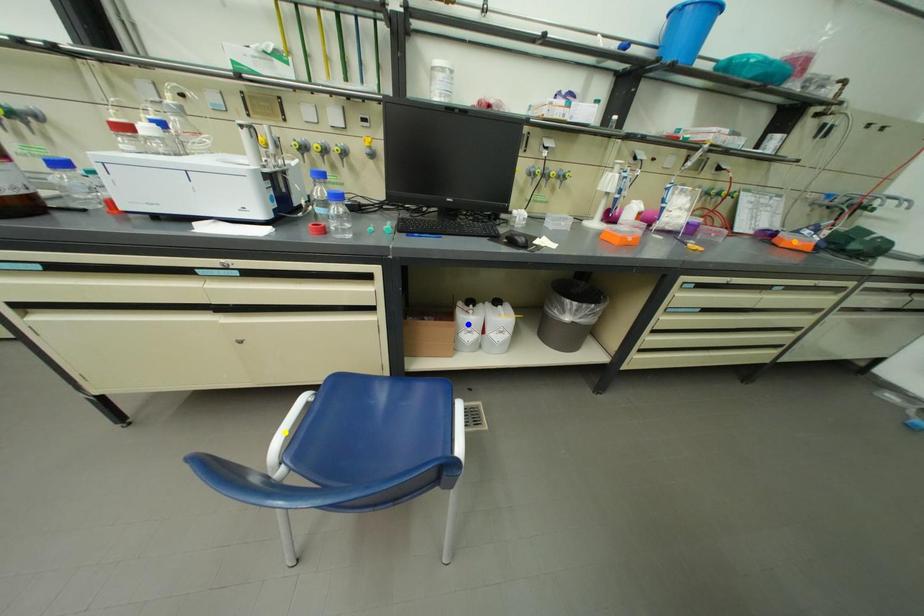
Order these from nearest to farthest:
blue point
yellow point
orange point

yellow point < blue point < orange point